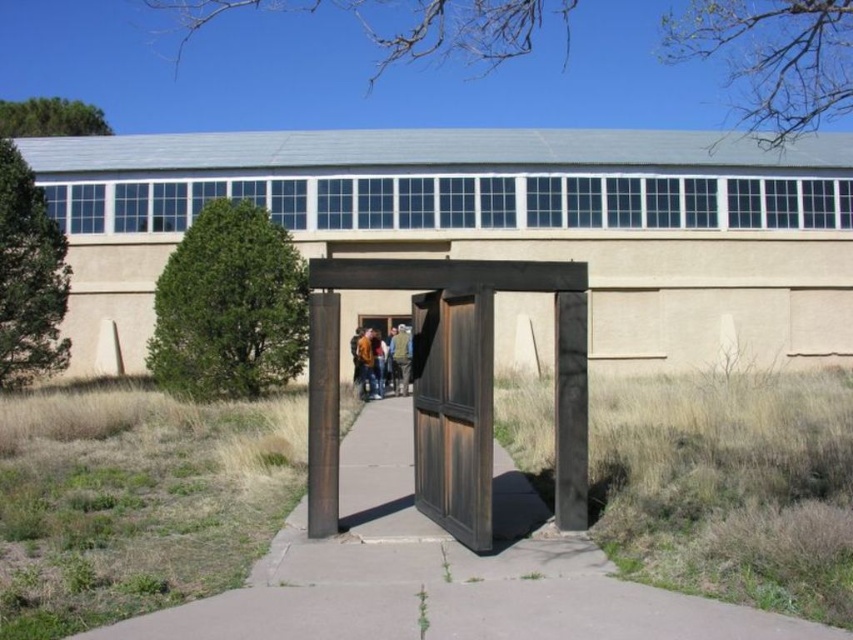
Question: Which object is positioned closest to the rustic wood gate at center?

Choices:
 (A) brown concrete pavement at center
 (B) charred wood door at center
 (C) matte brown jacket at center

Answer: (C)

Question: Which point is closer to the camera?

Choices:
 (A) brown leather jacket at center
 (B) orange jacket at center

Answer: (B)

Question: Is charred wood door at center smaller than dark brown wood gate at center?

Choices:
 (A) yes
 (B) no

Answer: (B)

Question: Can you confirm if dark brown wood gate at center is positioned to the left of orange jacket at center?

Choices:
 (A) yes
 (B) no

Answer: (B)

Question: Which object is farther from the camera taking this photo?

Choices:
 (A) orange jacket at center
 (B) charred wood door at center
 (C) matte brown jacket at center
 (D) dark wood gate at center

Answer: (A)

Question: Is brown concrete pavement at center wider than orange jacket at center?

Choices:
 (A) yes
 (B) no

Answer: (B)